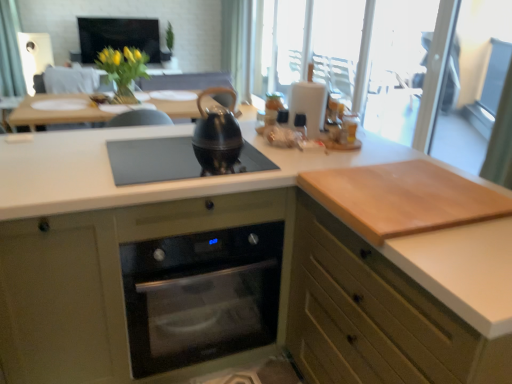
Question: Considering the positions of stainless steel oven at center and light brown wood cutting board at right in the image, is stainless steel oven at center wider or thinner than light brown wood cutting board at right?

Choices:
 (A) wide
 (B) thin

Answer: (A)

Question: Considering the positions of stainless steel oven at center and light brown wood cutting board at right in the image, is stainless steel oven at center bigger or smaller than light brown wood cutting board at right?

Choices:
 (A) small
 (B) big

Answer: (B)

Question: Estimate the real-world distances between objects in this image. Which object is closer to the black glass gas stove at center?

Choices:
 (A) transparent glass screen door at upper right
 (B) matte black screen at upper center
 (C) light brown wood cutting board at right
 (D) black matte kettle at center
 (E) wooden cutting board at right, placed as the second cabinetry when sorted from left to right

Answer: (D)

Question: Based on their relative distances, which object is nearer to the black matte kettle at center?

Choices:
 (A) olive green wood oven at center, the 1th cabinetry when ordered from left to right
 (B) transparent glass screen door at upper right
 (C) light brown wood cutting board at right
 (D) wooden cutting board at right, arranged as the 1th cabinetry when viewed from the right
 (E) black glass gas stove at center

Answer: (E)